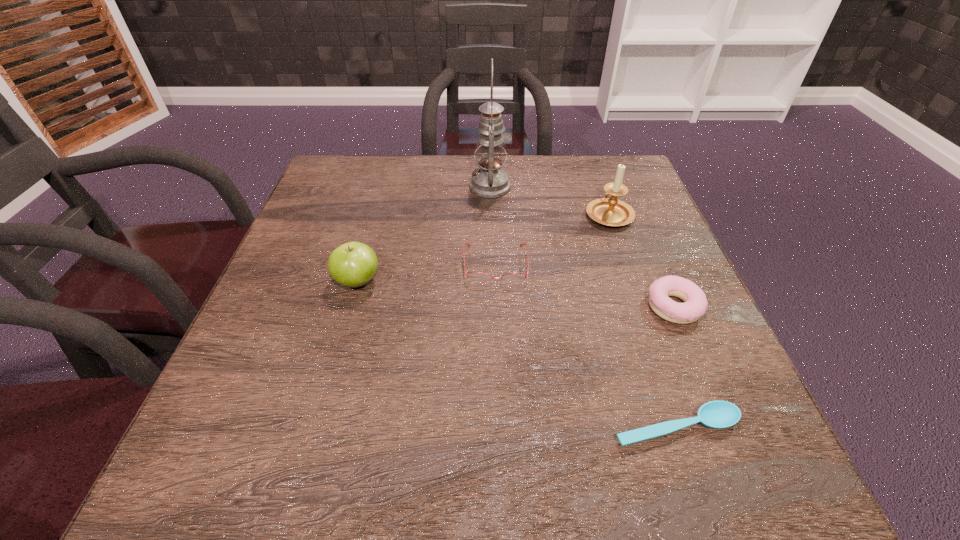
The width and height of the screenshot is (960, 540). Find the location of `empty location between the spectacles and the doughnut`. empty location between the spectacles and the doughnut is located at coordinates 586,286.

Where is `unoccupied area between the apple and the fifth tallest object`? This screenshot has width=960, height=540. unoccupied area between the apple and the fifth tallest object is located at coordinates (427, 273).

This screenshot has height=540, width=960. In order to click on vacant space in between the leftmost object and the oil lamp in this screenshot , I will do point(423,234).

Find the location of `free space between the second shortest object and the nearest object`. free space between the second shortest object and the nearest object is located at coordinates (586, 346).

Where is `vacant space in between the doughnut and the oil lamp`? vacant space in between the doughnut and the oil lamp is located at coordinates (582, 247).

The height and width of the screenshot is (540, 960). What are the coordinates of `free space between the second tallest object and the tallest object` in the screenshot? It's located at (549, 200).

Locate an element on the screen. Image resolution: width=960 pixels, height=540 pixels. free space between the spoon and the fifth tallest object is located at coordinates (586, 346).

Image resolution: width=960 pixels, height=540 pixels. I want to click on vacant point located between the shortest object and the fifth shortest object, so click(642, 321).

I want to click on unoccupied area between the candle holder and the leftmost object, so click(x=483, y=248).

At what (x,y) coordinates should I click in order to perform the action: click on vacant area that lies between the spoon and the second shortest object. Please return your answer as a coordinate pair (x, y). This screenshot has height=540, width=960. Looking at the image, I should click on (586, 346).